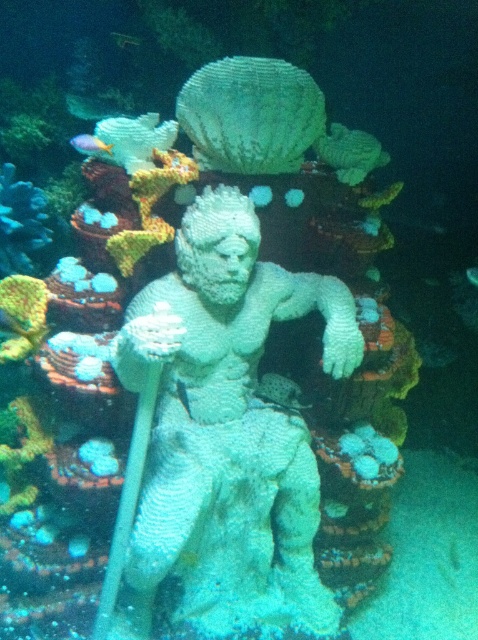
You are a diver with a 6 feet long measuring tape. You want to measure the distance between yourself and the point at coordinates point (90, 140). Can you reach it with your tape?

The point at coordinates point (90, 140) is 5.71 feet away from you, so yes, you can reach it with your 6 feet long measuring tape since it is longer than the distance.

You are a snorkeler who wants to take a photo of the green translucent fish at center. To do so, you need to position yourself so that the white textured statue at center is partially blocking the fish. Is this possible based on their positions?

The white textured statue at center is to the left of the green translucent fish at center, so if you position yourself to the right side of the fish, the statue would be to your left and not block the fish. However, if you are on the left side of the fish, the statue would be between you and the fish, allowing it to partially block the fish in your photo.

You are a scuba diver who wants to place a small marker between the two points, point [358,342] and point [108,150]. Which point is closer to you so that you can reach it first?

Point [358,342] is further to the viewer than point [108,150], so the point [108,150] is closer to you and you can reach it first.